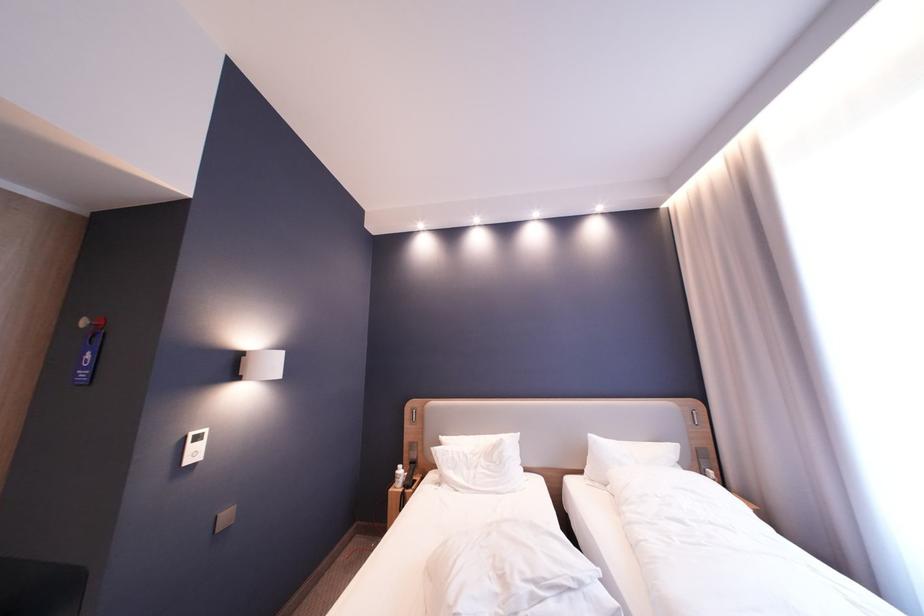
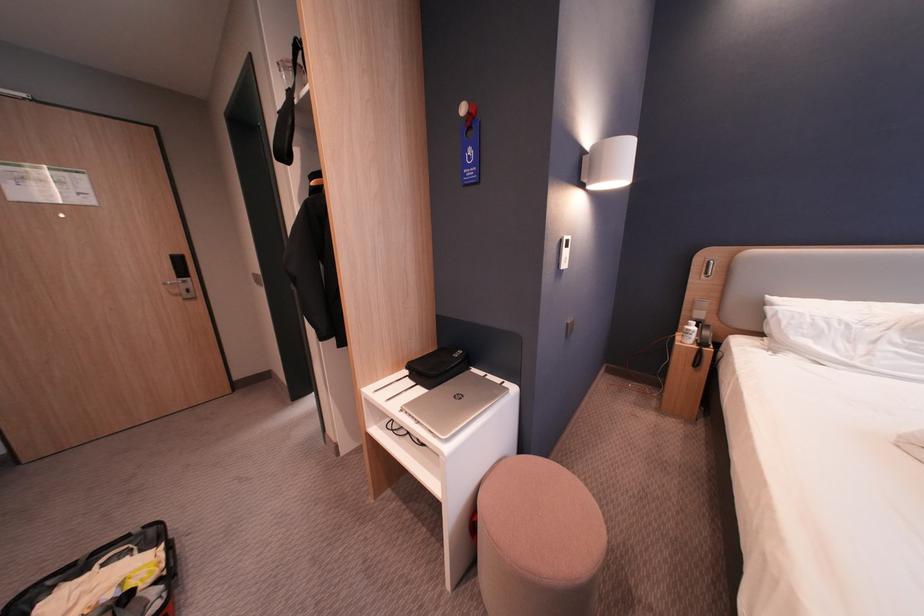
The point at (x=407, y=472) is marked in the first image. Where is the corresponding point in the second image?

(698, 328)